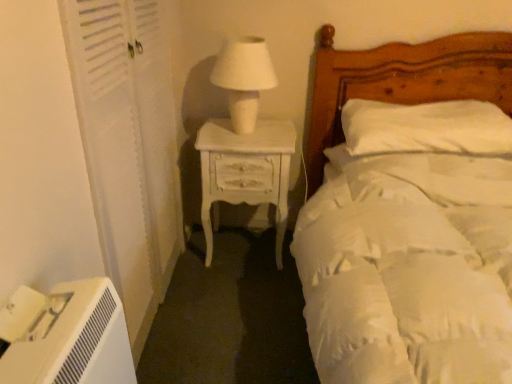
Question: Is white soft bed at upper right to the right of white matte table lamp at center from the viewer's perspective?

Choices:
 (A) no
 (B) yes

Answer: (B)

Question: Does white soft bed at upper right have a smaller size compared to white matte table lamp at center?

Choices:
 (A) yes
 (B) no

Answer: (B)

Question: Considering the relative positions of white soft bed at upper right and white matte table lamp at center in the image provided, is white soft bed at upper right behind white matte table lamp at center?

Choices:
 (A) no
 (B) yes

Answer: (A)

Question: Is white soft bed at upper right far from white matte table lamp at center?

Choices:
 (A) no
 (B) yes

Answer: (A)

Question: From the image's perspective, is white soft bed at upper right above white matte table lamp at center?

Choices:
 (A) yes
 (B) no

Answer: (B)

Question: From a real-world perspective, is white wooden screen door at left positioned above or below white painted wood nightstand at center left?

Choices:
 (A) above
 (B) below

Answer: (A)

Question: Do you think white wooden screen door at left is within white painted wood nightstand at center left, or outside of it?

Choices:
 (A) inside
 (B) outside

Answer: (B)

Question: Considering the positions of point (154, 79) and point (198, 139), is point (154, 79) closer or farther from the camera than point (198, 139)?

Choices:
 (A) closer
 (B) farther

Answer: (A)

Question: Considering the positions of white wooden screen door at left and white painted wood nightstand at center left in the image, is white wooden screen door at left wider or thinner than white painted wood nightstand at center left?

Choices:
 (A) thin
 (B) wide

Answer: (A)

Question: From a real-world perspective, is white painted wood nightstand at center left positioned above or below white soft bed at upper right?

Choices:
 (A) below
 (B) above

Answer: (A)

Question: From the image's perspective, is white painted wood nightstand at center left located above or below white soft bed at upper right?

Choices:
 (A) below
 (B) above

Answer: (B)

Question: Is white painted wood nightstand at center left in front of or behind white soft bed at upper right in the image?

Choices:
 (A) front
 (B) behind

Answer: (B)

Question: Visually, is white painted wood nightstand at center left positioned to the left or to the right of white soft bed at upper right?

Choices:
 (A) left
 (B) right

Answer: (A)

Question: In terms of width, does white matte table lamp at center look wider or thinner when compared to white painted wood nightstand at center left?

Choices:
 (A) wide
 (B) thin

Answer: (B)

Question: Considering the relative positions of white matte table lamp at center and white painted wood nightstand at center left in the image provided, is white matte table lamp at center to the left or to the right of white painted wood nightstand at center left?

Choices:
 (A) left
 (B) right

Answer: (A)